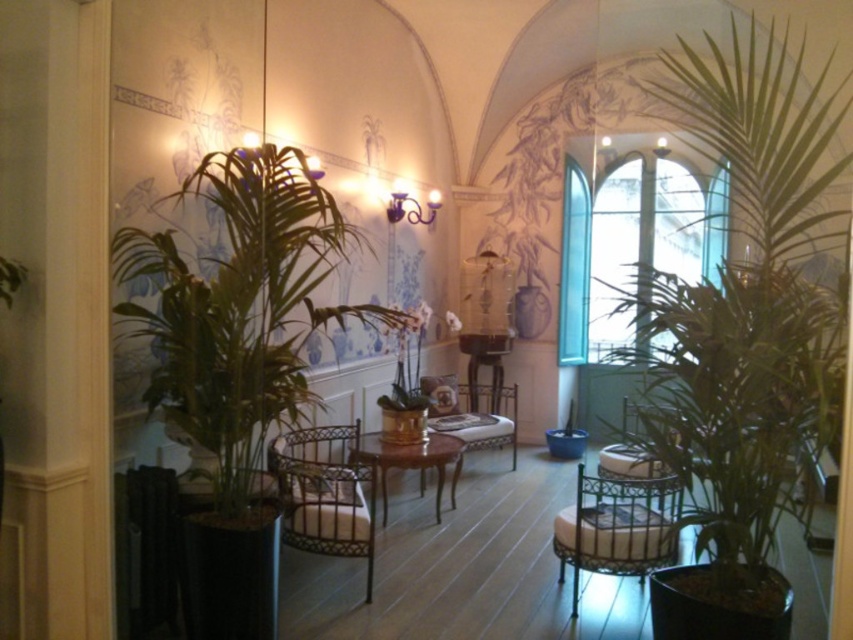
Is the position of green leafy plant at left more distant than that of metallic silver armchair at center?

No, green leafy plant at left is in front of metallic silver armchair at center.

The height and width of the screenshot is (640, 853). Find the location of `green leafy plant at left`. green leafy plant at left is located at coordinates (241, 307).

Which of these two, metallic gold armchair at center or wooden polished table at center, stands taller?

metallic gold armchair at center

Does point (575, 554) come behind point (372, 456)?

That is False.

Identify the location of metallic gold armchair at center. The image size is (853, 640). (618, 528).

Is metallic woven armchair at center taller than wooden polished table at center?

Correct, metallic woven armchair at center is much taller as wooden polished table at center.

Can you confirm if metallic woven armchair at center is smaller than wooden polished table at center?

No.

The height and width of the screenshot is (640, 853). I want to click on metallic woven armchair at center, so click(x=323, y=493).